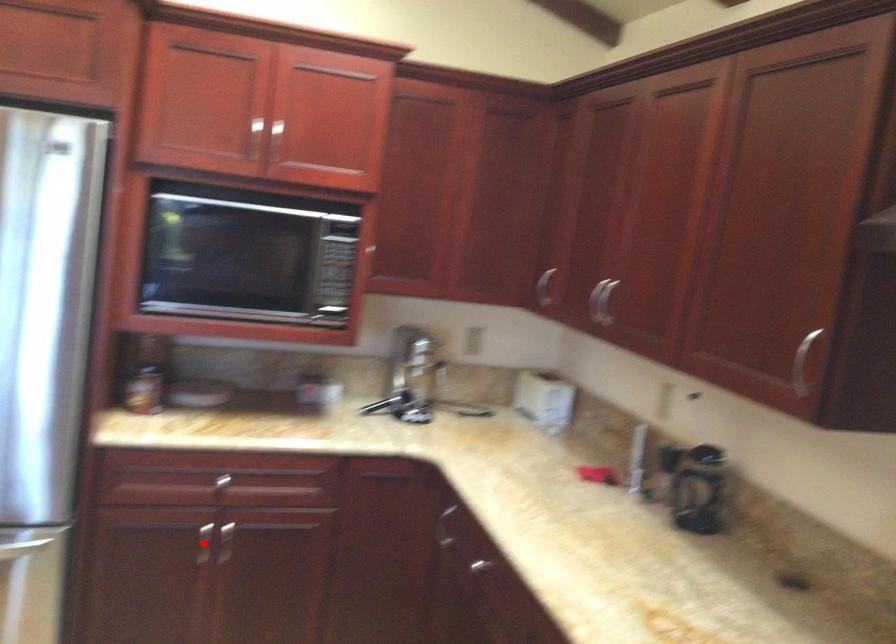
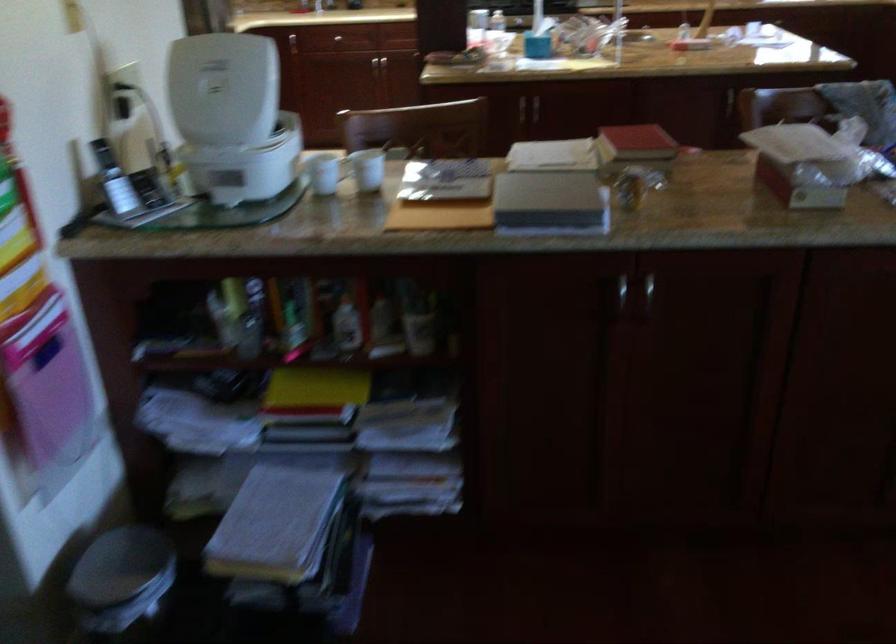
Question: I am providing you with two images of the same scene from different viewpoints. A red point is marked on the first image. Is the red point's position out of view in image 2?

Choices:
 (A) Yes
 (B) No

Answer: (A)